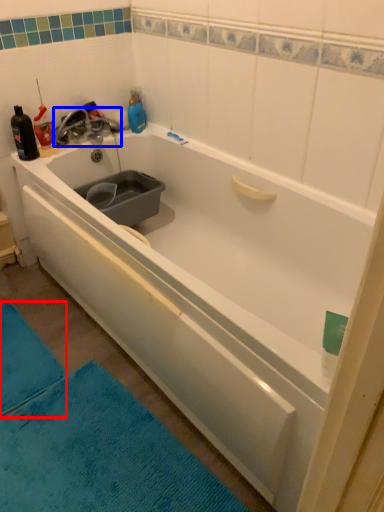
Question: Which object appears farthest to the camera in this image, bath mat (highlighted by a red box) or tap (highlighted by a blue box)?

Choices:
 (A) bath mat
 (B) tap

Answer: (B)